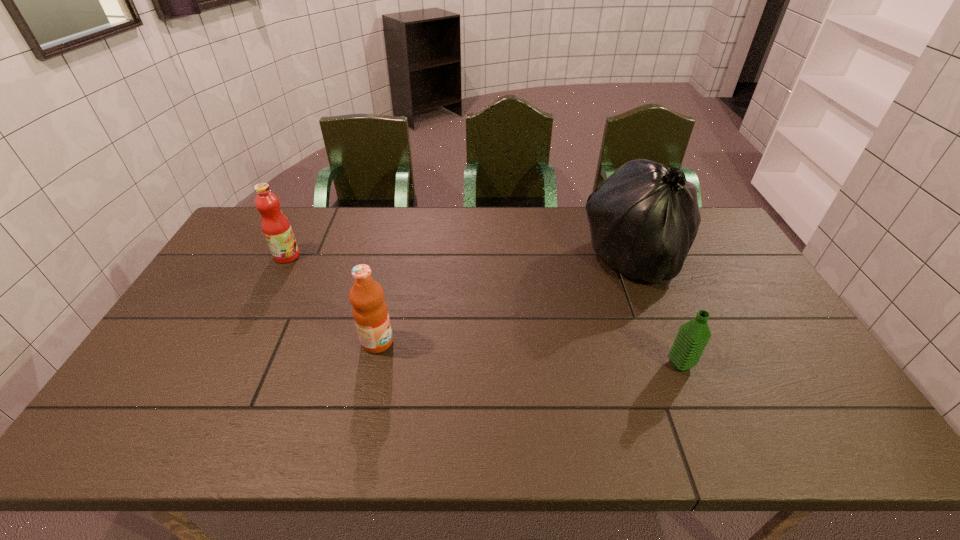
The image size is (960, 540). What are the coordinates of `object at the far edge` in the screenshot? It's located at (644, 218).

Image resolution: width=960 pixels, height=540 pixels. What are the coordinates of `vacant area at the far edge` in the screenshot? It's located at (403, 218).

Where is `vacant space at the near edge of the desktop`? Image resolution: width=960 pixels, height=540 pixels. vacant space at the near edge of the desktop is located at coordinates (446, 441).

This screenshot has height=540, width=960. I want to click on vacant region at the left edge of the desktop, so click(212, 274).

Locate an element on the screen. The width and height of the screenshot is (960, 540). blank space at the far left corner of the desktop is located at coordinates (248, 239).

The width and height of the screenshot is (960, 540). I want to click on vacant area between the leftmost object and the water bottle, so click(x=484, y=310).

I want to click on free space that is in between the right fruit juice and the left fruit juice, so click(332, 299).

Find the location of a particular element. vacant space in between the shortest object and the plastic bag is located at coordinates (658, 312).

In order to click on vacant area that lies between the leftmost object and the plastic bag in this screenshot , I will do `click(461, 258)`.

Identify the location of empty space between the farther fruit juice and the water bottle. The height and width of the screenshot is (540, 960). (484, 310).